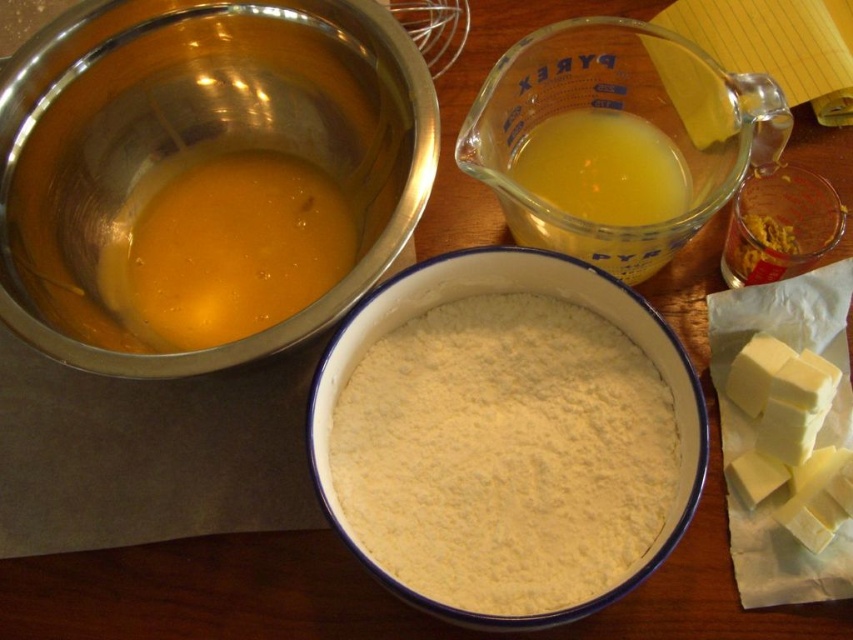
You are a baker who needs to determine which object is wider for arranging your workspace. Based on the scene, which object is wider between the shiny metallic bowl at upper left and the yellow crumbly mixture at upper right?

The shiny metallic bowl at upper left is wider than the yellow crumbly mixture at upper right according to the description.

From the picture: You are a chef preparing a recipe and need to pour the golden liquid at upper left into the shiny metallic bowl at upper left. Based on their positions, will the liquid flow into the bowl without spilling?

The shiny metallic bowl at upper left is above the golden liquid at upper left, so pouring the liquid into the bowl would require lifting the measuring cup higher than the bowl, which might cause spills unless done carefully.

You are a chef preparing a recipe and need to pour the liquid from the translucent glass measuring cup at upper center into the shiny metallic bowl at upper left. Can you do this without moving either object?

The shiny metallic bowl at upper left is below the translucent glass measuring cup at upper center, so yes, the chef can pour the liquid from the translucent glass measuring cup at upper center into the shiny metallic bowl at upper left because it is positioned above it.